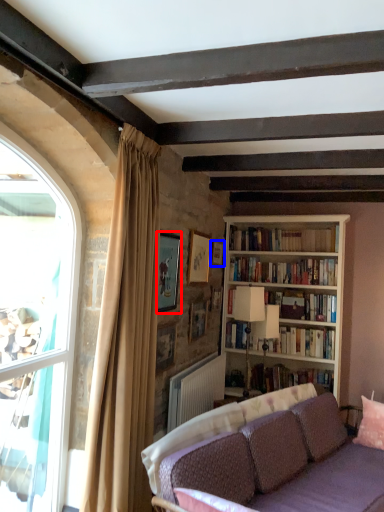
Question: Among these objects, which one is nearest to the camera, picture frame (highlighted by a red box) or picture frame (highlighted by a blue box)?

Choices:
 (A) picture frame
 (B) picture frame

Answer: (A)